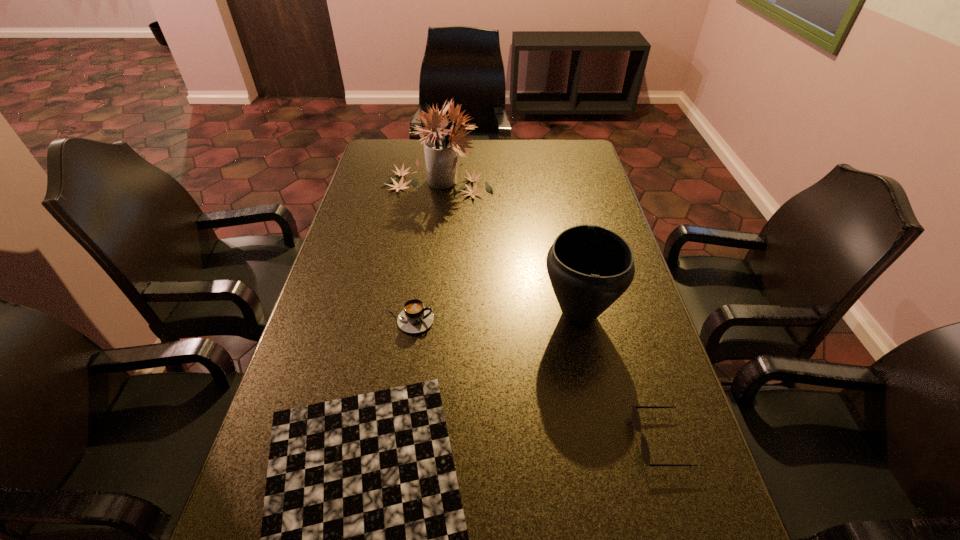
This screenshot has width=960, height=540. I want to click on the tallest object, so click(x=441, y=145).

The width and height of the screenshot is (960, 540). Identify the location of bouquet. (441, 145).

Locate an element on the screen. The width and height of the screenshot is (960, 540). urn is located at coordinates (589, 266).

I want to click on cappuccino, so click(x=415, y=318).

Locate an element on the screen. sunglasses is located at coordinates (636, 422).

Locate an element on the screen. The width and height of the screenshot is (960, 540). vacant space situated 0.340m on the right of the farthest object is located at coordinates (587, 183).

Find the location of `free region located 0.120m on the front of the fourth shortest object`. free region located 0.120m on the front of the fourth shortest object is located at coordinates (594, 390).

The width and height of the screenshot is (960, 540). I want to click on vacant space positioned with the handle on the side of the cappuccino, so click(542, 321).

At what (x,y) coordinates should I click in order to perform the action: click on free space located on the front-facing side of the sunglasses. Please return your answer as a coordinate pair (x, y). Looking at the image, I should click on (500, 441).

This screenshot has height=540, width=960. Find the location of `free space located on the front-facing side of the sunglasses`. free space located on the front-facing side of the sunglasses is located at coordinates (466, 441).